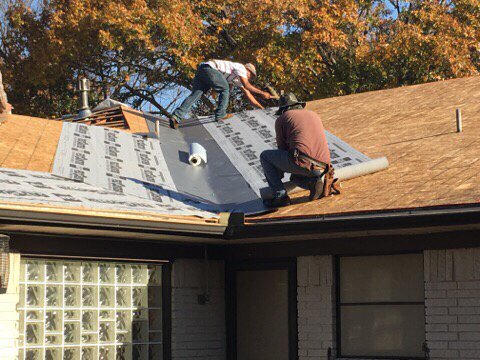
At what (x,y) coordinates should I click in order to perform the action: click on window. Please return your answer as a coordinate pair (x, y). Looking at the image, I should click on (382, 326).